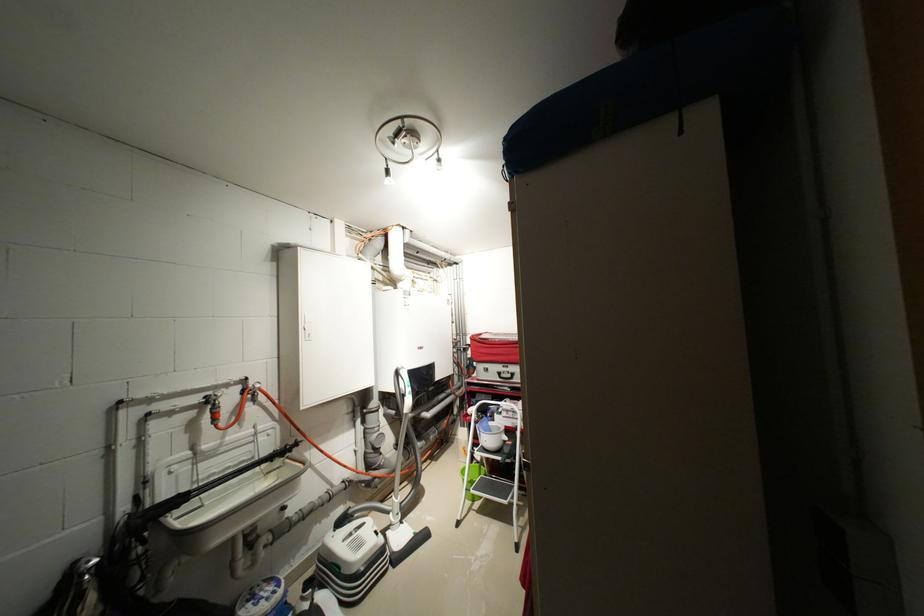
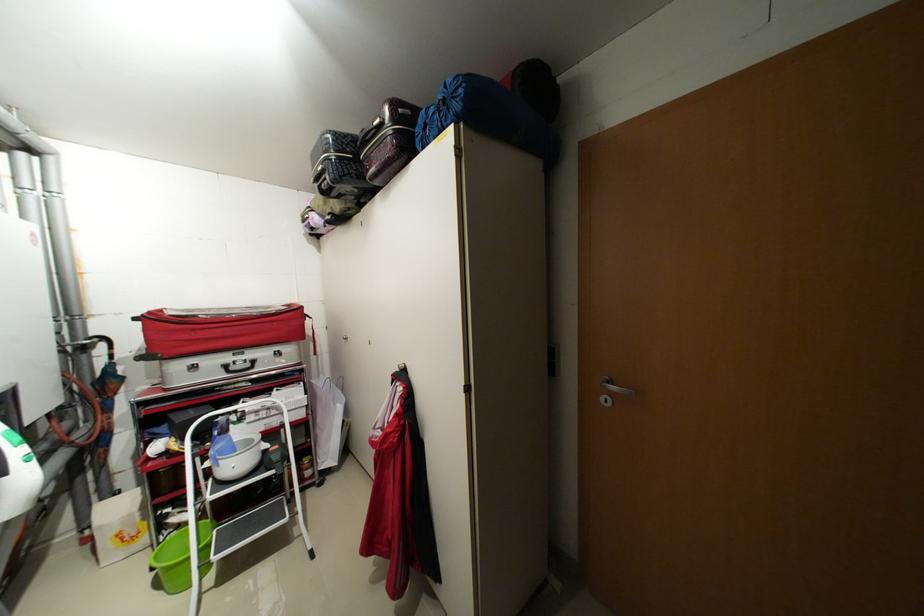
Question: The images are taken continuously from a first-person perspective. In which direction is your viewpoint rotating?

Choices:
 (A) Left
 (B) Right
 (C) Up
 (D) Down

Answer: (B)